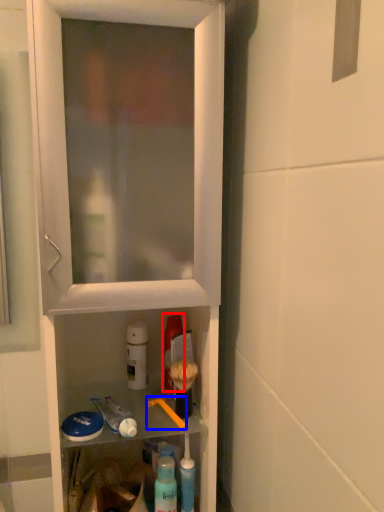
Question: Which point is further to the camera, mouthwash (highlighted by a red box) or brush (highlighted by a blue box)?

Choices:
 (A) mouthwash
 (B) brush

Answer: (A)